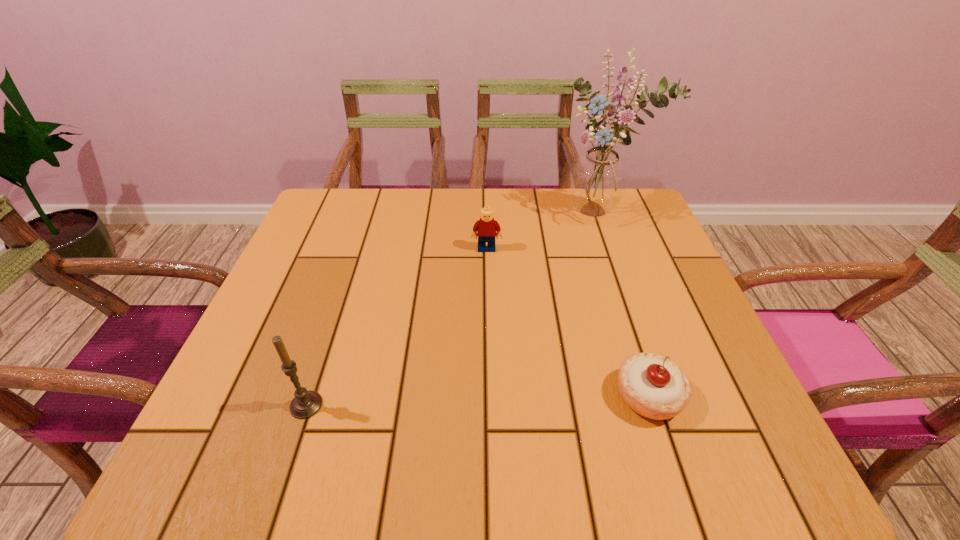
Find the location of a particular element. free space on the desktop that is between the leftmost object and the shortest object and is positioned on the front-facing side of the Lego is located at coordinates coord(490,400).

Find the location of a particular element. This screenshot has width=960, height=540. vacant spot on the desktop that is between the candle and the pastry and is positioned on the front-facing side of the bouquet is located at coordinates (521, 399).